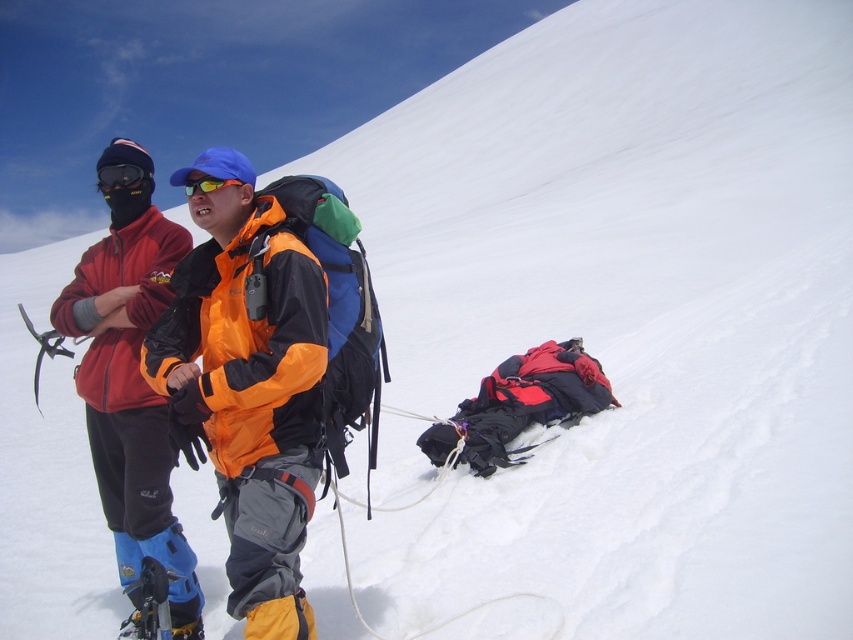
Is point (123, 364) in front of point (106, 182)?

No, it is not.

Can you confirm if matte orange jacket at center is positioned above black matte goggles at upper left?

Actually, matte orange jacket at center is below black matte goggles at upper left.

Is point (189, 369) behind point (132, 172)?

No, (189, 369) is in front of (132, 172).

Identify the location of matte orange jacket at center. (136, 388).